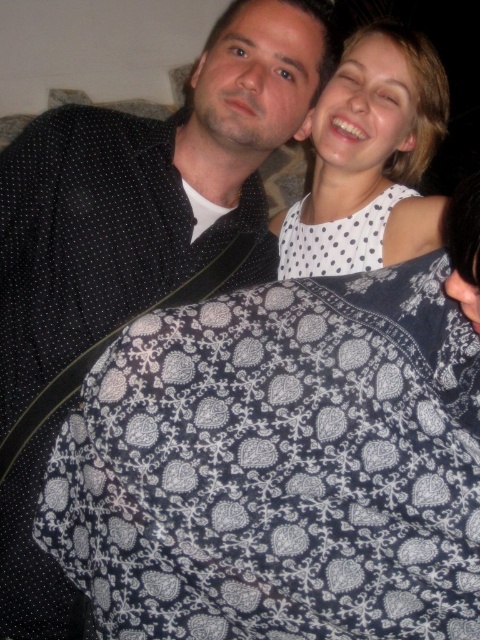
You are a photographer setting up for a photoshoot. You need to position a light source to the right of the white dotted dress at upper right so it doesn not cast a shadow on the dark blue fabric at center. Where should you place the light?

Place the light to the right of the white dotted dress at upper right, ensuring it is positioned away from the dark blue fabric at center to avoid casting shadows on it.

You are a photographer setting up a shoot in this room. You need to position a light source so that it illuminates both the black dotted shirt at upper left and the white dotted dress at upper right equally. Considering their heights, where should you place the light source?

The black dotted shirt at upper left is much taller than the white dotted dress at upper right. To illuminate both equally, the light source should be placed at a height between their two heights so that it can reach both effectively.

You are a photographer setting up for a photoshoot. You need to position a light source to the left of the black dotted shirt at upper left and to the right of the white dotted dress at upper right. Is this possible given their positions?

The black dotted shirt at upper left is to the left of the white dotted dress at upper right. Therefore, placing a light source to the left of the black dotted shirt at upper left and to the right of the white dotted dress at upper right is not possible because the shirt is already positioned to the left of the dress, making the required placement contradictory.